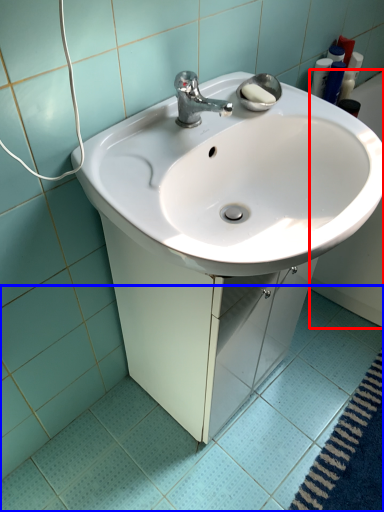
Question: Which of the following is the closest to the observer, bath (highlighted by a red box) or ceramic tile (highlighted by a blue box)?

Choices:
 (A) bath
 (B) ceramic tile

Answer: (B)